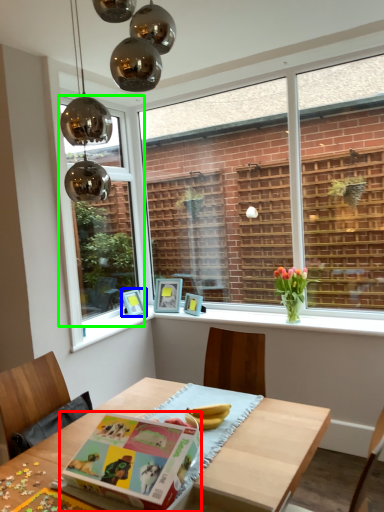
Question: Estimate the real-world distances between objects in this image. Which object is closer to paperback book (highlighted by a red box), picture frame (highlighted by a blue box) or window (highlighted by a green box)?

Choices:
 (A) picture frame
 (B) window

Answer: (B)